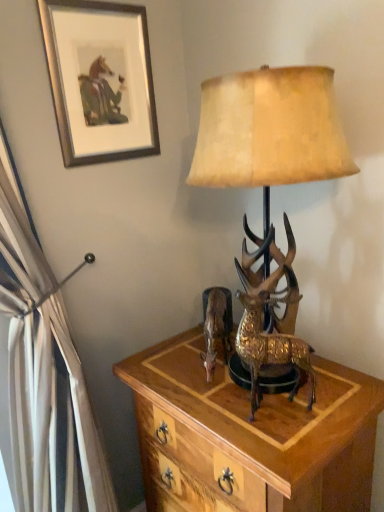
The image size is (384, 512). I want to click on vacant space in front of gold textured deer at center, so click(x=284, y=442).